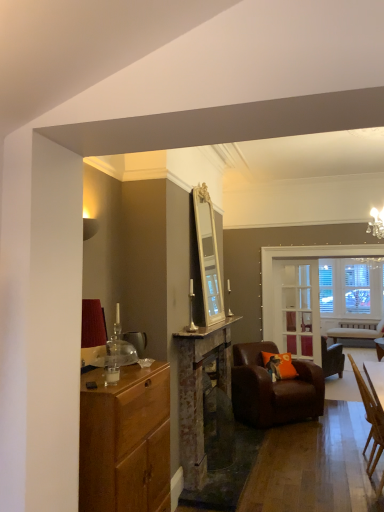
Question: From the image's perspective, is marble counter top at center under clear glass door at center?

Choices:
 (A) yes
 (B) no

Answer: (B)

Question: Is marble counter top at center outside clear glass door at center?

Choices:
 (A) yes
 (B) no

Answer: (A)

Question: Considering the relative positions of marble counter top at center and clear glass door at center in the image provided, is marble counter top at center in front of clear glass door at center?

Choices:
 (A) no
 (B) yes

Answer: (B)

Question: Considering the relative sizes of marble counter top at center and clear glass door at center in the image provided, is marble counter top at center taller than clear glass door at center?

Choices:
 (A) no
 (B) yes

Answer: (A)

Question: From a real-world perspective, is marble counter top at center located beneath clear glass door at center?

Choices:
 (A) yes
 (B) no

Answer: (B)

Question: In the image, is brown leather armchair at center, which is the second chair in front-to-back order, positioned in front of or behind brown leather armchair at center, placed as the 1th chair when sorted from back to front?

Choices:
 (A) front
 (B) behind

Answer: (A)

Question: From a real-world perspective, relative to brown leather armchair at center, the third chair when ordered from front to back, is brown leather armchair at center, which is the second chair in front-to-back order, vertically above or below?

Choices:
 (A) above
 (B) below

Answer: (B)

Question: Considering the relative positions of brown leather armchair at center, the 2th chair viewed from the back, and brown leather armchair at center, the third chair when ordered from front to back, in the image provided, is brown leather armchair at center, the 2th chair viewed from the back, to the left or to the right of brown leather armchair at center, the third chair when ordered from front to back,?

Choices:
 (A) left
 (B) right

Answer: (A)

Question: Looking at the image, does brown leather armchair at center, the 2th chair viewed from the back, seem bigger or smaller compared to brown leather armchair at center, the third chair when ordered from front to back?

Choices:
 (A) big
 (B) small

Answer: (B)

Question: Is light brown wooden chair at lower right, the first chair positioned from the front, taller or shorter than brown leather armchair at center, the 2th chair viewed from the back?

Choices:
 (A) tall
 (B) short

Answer: (A)

Question: Is light brown wooden chair at lower right, the first chair positioned from the front, situated inside brown leather armchair at center, which is the second chair in front-to-back order, or outside?

Choices:
 (A) inside
 (B) outside

Answer: (B)

Question: From a real-world perspective, is light brown wooden chair at lower right, which ranks as the 3th chair in back-to-front order, positioned above or below brown leather armchair at center, which is the second chair in front-to-back order?

Choices:
 (A) below
 (B) above

Answer: (B)

Question: Considering their positions, is light brown wooden chair at lower right, which ranks as the 3th chair in back-to-front order, located in front of or behind brown leather armchair at center, which is the second chair in front-to-back order?

Choices:
 (A) front
 (B) behind

Answer: (A)

Question: From the image's perspective, relative to brown leather armchair at center, the third chair when ordered from front to back, is wooden cabinet at left above or below?

Choices:
 (A) below
 (B) above

Answer: (B)

Question: From a real-world perspective, relative to brown leather armchair at center, placed as the 1th chair when sorted from back to front, is wooden cabinet at left vertically above or below?

Choices:
 (A) above
 (B) below

Answer: (A)